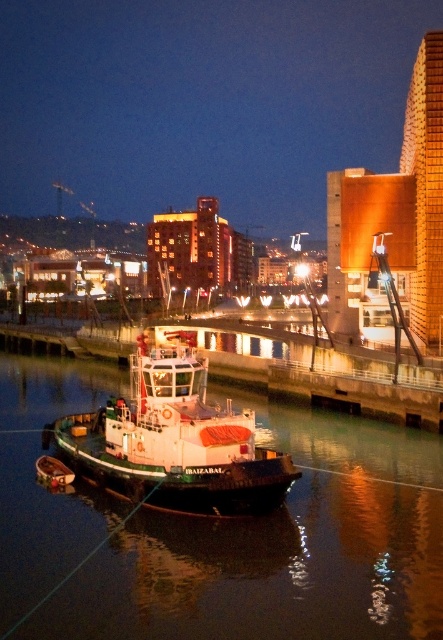
Question: Which point is closer to the camera?

Choices:
 (A) black rubber water at lower center
 (B) white matte boat at center

Answer: (A)

Question: Does black rubber water at lower center appear under white matte boat at center?

Choices:
 (A) yes
 (B) no

Answer: (A)

Question: In this image, where is black rubber water at lower center located relative to white matte boat at center?

Choices:
 (A) below
 (B) above

Answer: (A)

Question: Can you confirm if black rubber water at lower center is positioned to the right of white matte boat at center?

Choices:
 (A) yes
 (B) no

Answer: (B)